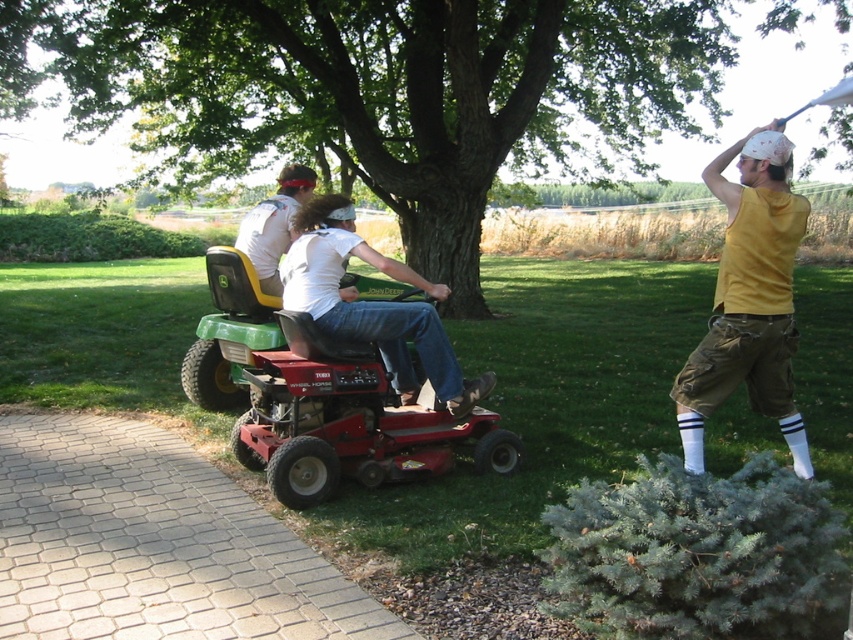
Question: Estimate the real-world distances between objects in this image. Which object is closer to the matte red lawn mower at center?

Choices:
 (A) matte white shirt at center
 (B) green plastic lawn mower at center

Answer: (B)

Question: Considering the real-world distances, which object is closest to the matte white shirt at center?

Choices:
 (A) yellow sleeveless shirt at right
 (B) matte red lawn mower at center

Answer: (B)

Question: Observing the image, what is the correct spatial positioning of green plastic lawn mower at center in reference to matte red lawn mower at center?

Choices:
 (A) left
 (B) right

Answer: (A)

Question: Which object is the farthest from the matte red lawn mower at center?

Choices:
 (A) green plastic lawn mower at center
 (B) matte white shirt at center

Answer: (B)

Question: Does yellow sleeveless shirt at right have a smaller size compared to matte white shirt at center?

Choices:
 (A) no
 (B) yes

Answer: (A)

Question: Is the position of green plastic lawn mower at center less distant than that of matte red lawn mower at center?

Choices:
 (A) yes
 (B) no

Answer: (A)